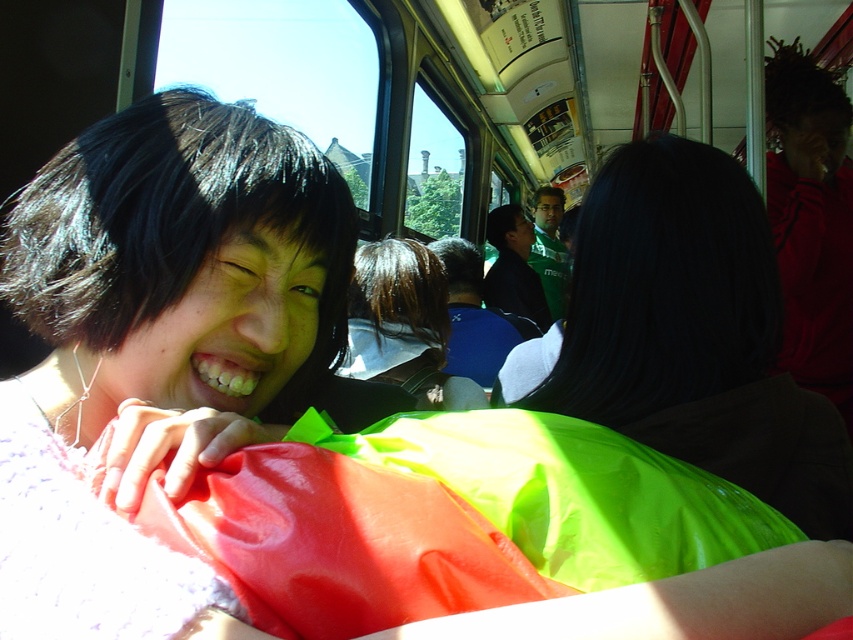
Measure the distance between point (543, 317) and camera.

A distance of 4.37 meters exists between point (543, 317) and camera.

Who is shorter, dark green shirt at center or green jersey at center?

dark green shirt at center

Between point (538, 326) and point (544, 244), which one is positioned behind?

The point (544, 244) is behind.

I want to click on dark green shirt at center, so click(514, 268).

Looking at this image, is shiny black hair at center taller than green jersey at center?

No, shiny black hair at center is not taller than green jersey at center.

Describe the element at coordinates (403, 324) in the screenshot. Image resolution: width=853 pixels, height=640 pixels. I see `shiny black hair at center` at that location.

Does point (393, 257) come in front of point (561, 262)?

Yes, it is in front of point (561, 262).

Where is `shiny black hair at center`? shiny black hair at center is located at coordinates (403, 324).

Can you confirm if neon green fabric at center is shorter than shiny black hair at center?

No.

Which is below, neon green fabric at center or shiny black hair at center?

neon green fabric at center is lower down.

Image resolution: width=853 pixels, height=640 pixels. What do you see at coordinates (693, 333) in the screenshot?
I see `neon green fabric at center` at bounding box center [693, 333].

Locate an element on the screen. neon green fabric at center is located at coordinates (693, 333).